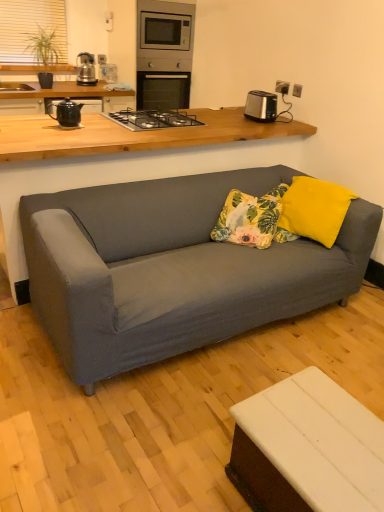
Question: Is floral fabric pillow at center situated inside black metal gas stove at upper center or outside?

Choices:
 (A) outside
 (B) inside

Answer: (A)

Question: From the image's perspective, is floral fabric pillow at center positioned above or below black metal gas stove at upper center?

Choices:
 (A) above
 (B) below

Answer: (B)

Question: Which object is the closest to the beige fabric window screen at upper left?

Choices:
 (A) black ceramic teapot at left
 (B) white matte table at lower right, which is the second table from top to bottom
 (C) stainless steel oven at upper center
 (D) yellow fabric pillow at center
 (E) floral fabric pillow at center

Answer: (C)

Question: Which object is positioned closest to the matte gray couch at center, the first table positioned from the top?

Choices:
 (A) floral fabric pillow at center
 (B) black ceramic teapot at left
 (C) satin silver toaster at upper right
 (D) stainless steel oven at upper center
 (E) yellow fabric pillow at center

Answer: (B)